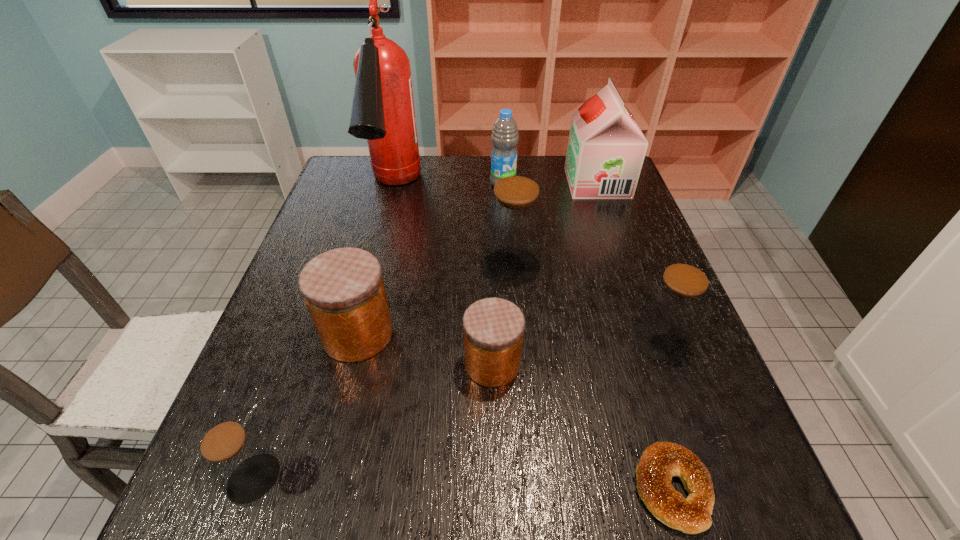
You are a GUI agent. You are given a task and a screenshot of the screen. Output one action in this format:
    pyautogui.click(x=<x>, y=<y>)
    Task: Click on the vacant area situated on the front of the bigger orange jar
    The height and width of the screenshot is (540, 960).
    Given the screenshot: What is the action you would take?
    pyautogui.click(x=335, y=425)

Locate an element on the screen. Image resolution: width=960 pixels, height=540 pixels. vacant region located 0.360m on the back of the second nearest brown jar is located at coordinates (615, 220).

The height and width of the screenshot is (540, 960). I want to click on free location located on the back of the right orange jar, so click(491, 306).

You are a GUI agent. You are given a task and a screenshot of the screen. Output one action in this format:
    pyautogui.click(x=<x>, y=<y>)
    Task: Click on the free space located on the back of the smallest brown jar
    This screenshot has height=540, width=960.
    Given the screenshot: What is the action you would take?
    [x=300, y=353]

What are the coordinates of `free region located on the back of the bagel` in the screenshot? It's located at (631, 352).

You are a GUI agent. You are given a task and a screenshot of the screen. Output one action in this format:
    pyautogui.click(x=<x>, y=<y>)
    Task: Click on the fire extinguisher that is at the far edge
    
    Given the screenshot: What is the action you would take?
    pyautogui.click(x=383, y=112)

Find the location of a particular element. Image resolution: width=960 pixels, height=540 pixels. soya milk positioned at the far edge is located at coordinates click(x=606, y=148).

The width and height of the screenshot is (960, 540). Find the location of `water bottle that is at the far edge`. water bottle that is at the far edge is located at coordinates (504, 137).

The height and width of the screenshot is (540, 960). What are the coordinates of `jar present at the near edge` in the screenshot? It's located at (236, 458).

Where is `bagel that is positioned at the near edge`? bagel that is positioned at the near edge is located at coordinates (660, 461).